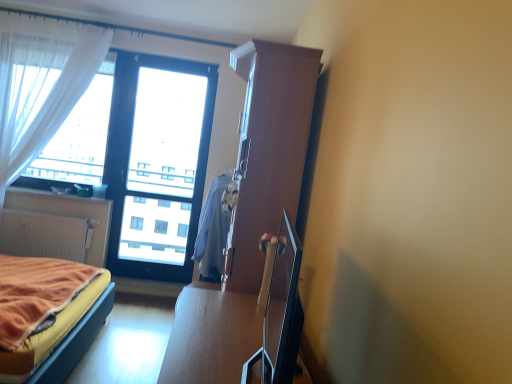
Question: From a real-world perspective, is velvet orange bed at lower left physically above white sheer curtain at left?

Choices:
 (A) no
 (B) yes

Answer: (A)

Question: Are velvet orange bed at lower left and white sheer curtain at left located far from each other?

Choices:
 (A) no
 (B) yes

Answer: (B)

Question: Is white sheer curtain at left surrounded by velvet orange bed at lower left?

Choices:
 (A) yes
 (B) no

Answer: (B)

Question: Is velvet orange bed at lower left further to camera compared to white sheer curtain at left?

Choices:
 (A) yes
 (B) no

Answer: (B)

Question: Could you tell me if velvet orange bed at lower left is facing white sheer curtain at left?

Choices:
 (A) no
 (B) yes

Answer: (A)

Question: From a real-world perspective, is velvet orange bed at lower left physically below white sheer curtain at left?

Choices:
 (A) yes
 (B) no

Answer: (A)

Question: From a real-world perspective, is white sheer curtain at left positioned under matte white radiator at lower left based on gravity?

Choices:
 (A) yes
 (B) no

Answer: (B)

Question: Is white sheer curtain at left positioned in front of matte white radiator at lower left?

Choices:
 (A) no
 (B) yes

Answer: (A)

Question: Could you tell me if white sheer curtain at left is facing matte white radiator at lower left?

Choices:
 (A) no
 (B) yes

Answer: (A)

Question: Considering the relative sizes of white sheer curtain at left and matte white radiator at lower left in the image provided, is white sheer curtain at left thinner than matte white radiator at lower left?

Choices:
 (A) yes
 (B) no

Answer: (A)

Question: From a real-world perspective, does white sheer curtain at left stand above matte white radiator at lower left?

Choices:
 (A) yes
 (B) no

Answer: (A)

Question: Is white sheer curtain at left not inside matte white radiator at lower left?

Choices:
 (A) no
 (B) yes

Answer: (B)

Question: Is transparent glass window at center further to camera compared to white sheer curtain at left?

Choices:
 (A) no
 (B) yes

Answer: (B)